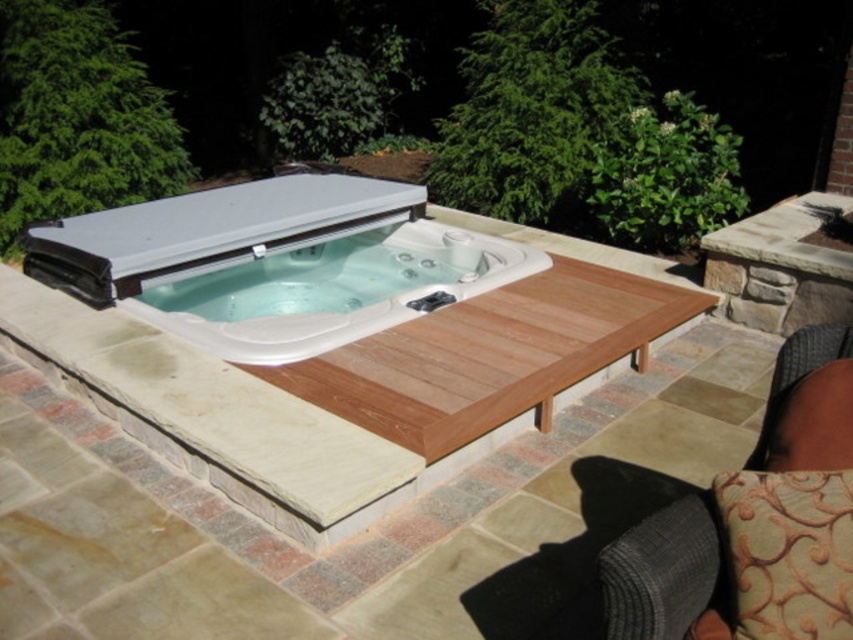
Is point (480, 435) closer to viewer compared to point (506, 314)?

Yes, point (480, 435) is closer to viewer.

Does brown wood deck at center have a lesser height compared to teak wood deck at center?

No, brown wood deck at center is not shorter than teak wood deck at center.

The width and height of the screenshot is (853, 640). I want to click on brown wood deck at center, so click(x=338, y=348).

In order to click on brown wood deck at center in this screenshot , I will do `click(338, 348)`.

Is teak wood deck at center thinner than white glossy hot tub at center?

No, teak wood deck at center is not thinner than white glossy hot tub at center.

Between teak wood deck at center and white glossy hot tub at center, which one is positioned lower?

teak wood deck at center is below.

Is point (689, 317) positioned before point (358, 278)?

Yes, point (689, 317) is in front of point (358, 278).

Locate an element on the screen. teak wood deck at center is located at coordinates click(489, 355).

Between point (456, 369) and point (318, 288), which one is positioned in front?

Point (456, 369)

Which is above, brown wood deck at center or white glossy hot tub at center?

Positioned higher is white glossy hot tub at center.

Where is `brown wood deck at center`? Image resolution: width=853 pixels, height=640 pixels. brown wood deck at center is located at coordinates (338, 348).